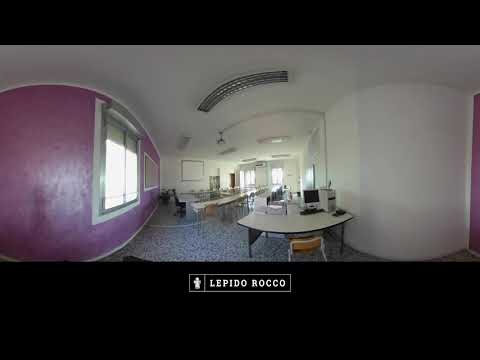
Identify the location of rolling desk chair. Image resolution: width=480 pixels, height=360 pixels. (180, 199).